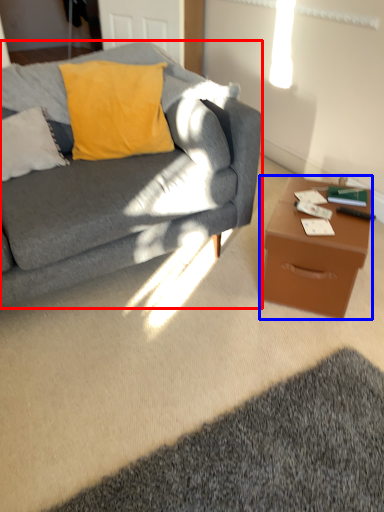
Question: Among these objects, which one is nearest to the camera, studio couch (highlighted by a red box) or desk (highlighted by a blue box)?

Choices:
 (A) studio couch
 (B) desk

Answer: (A)